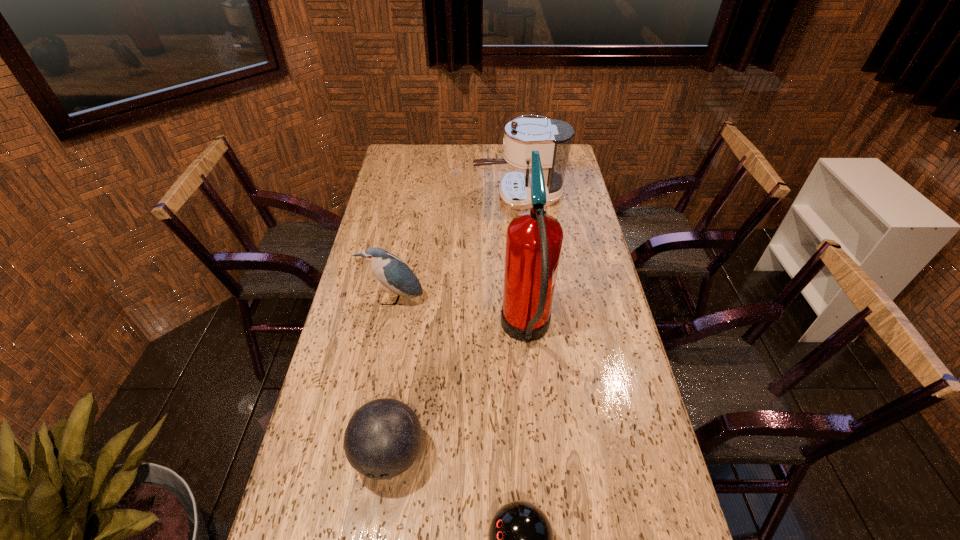
What are the coordinates of `vacant space located 0.280m at the tip of the third shortest object's beak` in the screenshot? It's located at [377, 386].

Find the location of a particular element. This screenshot has height=540, width=960. free space located on the grip area of the second shortest object is located at coordinates [x=379, y=521].

In order to click on bird positioned at the left edge in this screenshot , I will do `click(390, 270)`.

Where is `bowling ball that is at the left edge`? This screenshot has height=540, width=960. bowling ball that is at the left edge is located at coordinates (383, 438).

What are the coordinates of `object positioned at the right edge` in the screenshot? It's located at (552, 138).

In the image, there is a desktop. Identify the location of vacant space at the far edge. The height and width of the screenshot is (540, 960). (499, 154).

This screenshot has width=960, height=540. In the image, there is a desktop. What are the coordinates of `free region at the left edge` in the screenshot? It's located at (385, 325).

The image size is (960, 540). In order to click on free space at the right edge of the desktop in this screenshot , I will do `click(548, 207)`.

Find the location of a particular element. vacant space at the far right corner is located at coordinates (569, 168).

Find the location of a particular element. Image resolution: width=960 pixels, height=540 pixels. vacant point located between the third tallest object and the taller bowling ball is located at coordinates (392, 377).